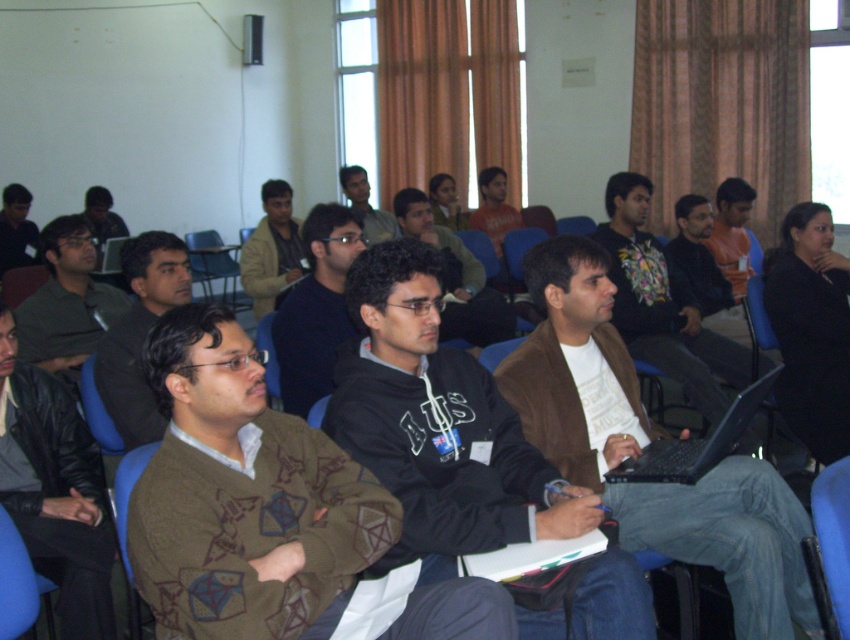
You are sitting in one of the blue chairs in the classroom. You notice two points marked on the floor at coordinates point (112, 328) and point (95, 211). If you want to move closer to the front of the classroom, which point should you walk towards?

You should walk towards point (112, 328) because it is in front of point (95, 211), meaning it is closer to the front of the classroom.

You are organizing a workshop in this classroom and need to ensure all participants have enough space. You notice two matte black laptops present. Which one, the matte black laptop at upper left or the matte black laptop at left, requires more desk space due to its size?

The matte black laptop at upper left requires more desk space because it is larger in size than the matte black laptop at left.